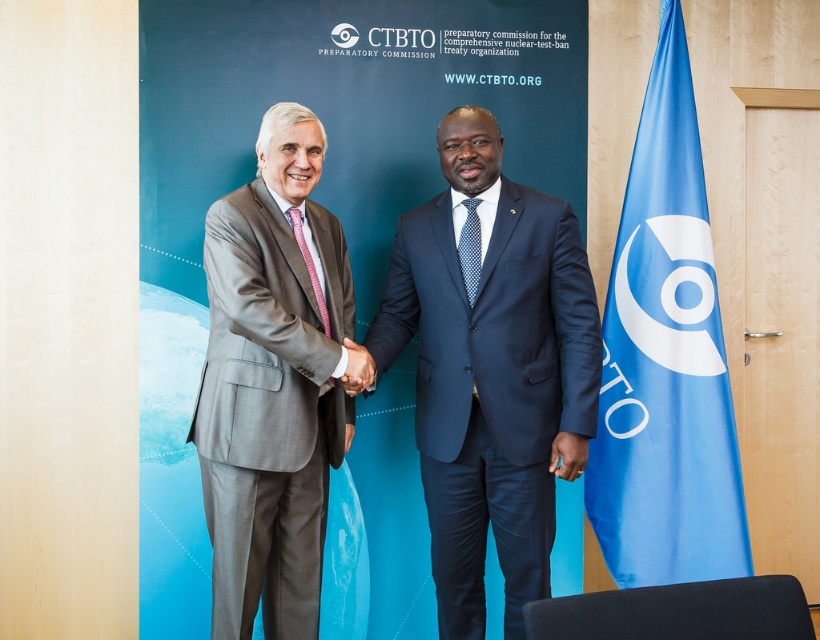
Can you confirm if gray wool suit at center is positioned to the left of pink textured tie at center?

Yes, gray wool suit at center is to the left of pink textured tie at center.

Who is positioned more to the left, gray wool suit at center or pink textured tie at center?

gray wool suit at center is more to the left.

Locate an element on the screen. gray wool suit at center is located at coordinates (272, 384).

Who is taller, blue fabric flag at right or blue dotted tie at center?

blue fabric flag at right is taller.

Between point (700, 460) and point (468, 275), which one is positioned behind?

Point (700, 460)

This screenshot has width=820, height=640. Identify the location of blue fabric flag at right. (664, 360).

Can you confirm if gray wool suit at center is bigger than blue fabric flag at right?

Yes.

Does gray wool suit at center appear under blue fabric flag at right?

Indeed, gray wool suit at center is positioned under blue fabric flag at right.

Who is more distant from viewer, (340,320) or (607,448)?

The point (607,448) is more distant.

At what (x,y) coordinates should I click in order to perform the action: click on gray wool suit at center. Please return your answer as a coordinate pair (x, y). Looking at the image, I should click on (272, 384).